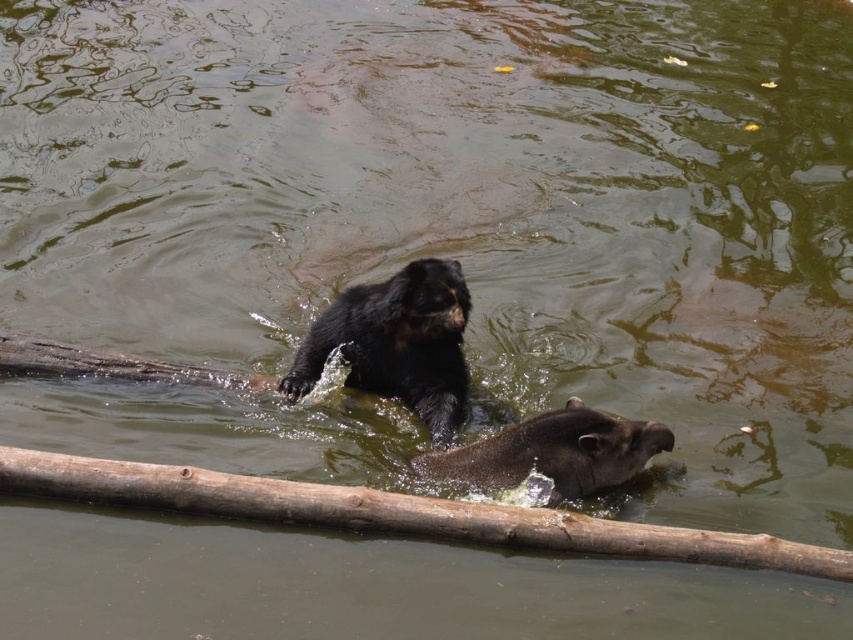
Question: Does brown rough wood at center have a lesser width compared to black furry bear at upper center?

Choices:
 (A) no
 (B) yes

Answer: (A)

Question: Which object is positioned farthest from the brown rough wood at center?

Choices:
 (A) black furry bear at upper center
 (B) brown fuzzy tapir at lower center

Answer: (A)

Question: Based on their relative distances, which object is nearer to the brown fuzzy tapir at lower center?

Choices:
 (A) black furry bear at upper center
 (B) brown rough wood at center

Answer: (B)

Question: Which point is farther to the camera?

Choices:
 (A) (583, 404)
 (B) (718, 552)
 (C) (450, 301)

Answer: (A)

Question: Is black furry bear at upper center in front of brown fuzzy tapir at lower center?

Choices:
 (A) no
 (B) yes

Answer: (A)

Question: Does brown rough wood at center appear under black furry bear at upper center?

Choices:
 (A) yes
 (B) no

Answer: (A)